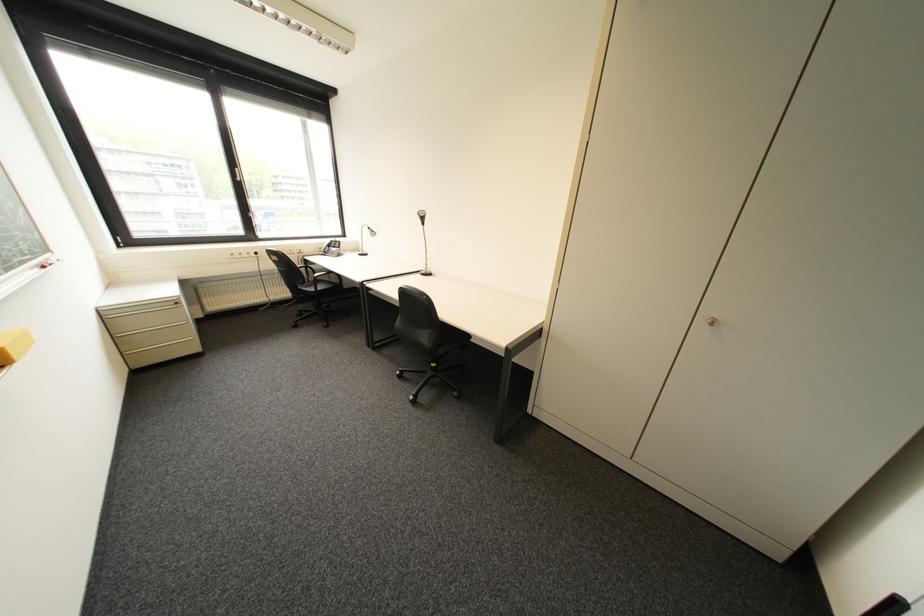
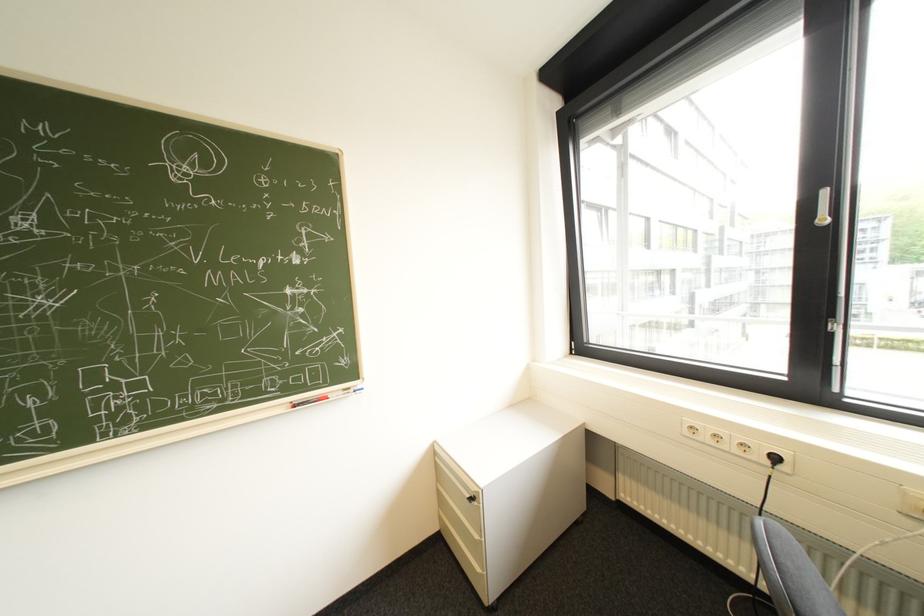
Where in the second image is the point corresponding to point 188,304 from the first image?

(482, 499)